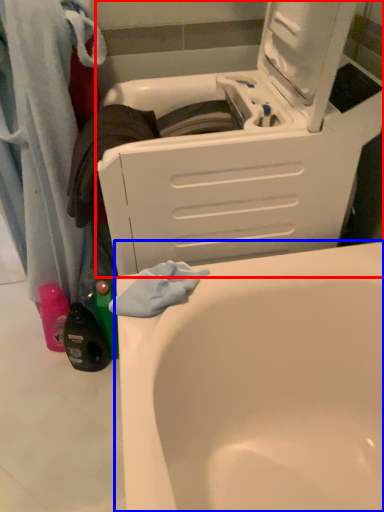
Question: Which point is closer to the camera, washing machine (highlighted by a red box) or bathtub (highlighted by a blue box)?

Choices:
 (A) washing machine
 (B) bathtub

Answer: (A)